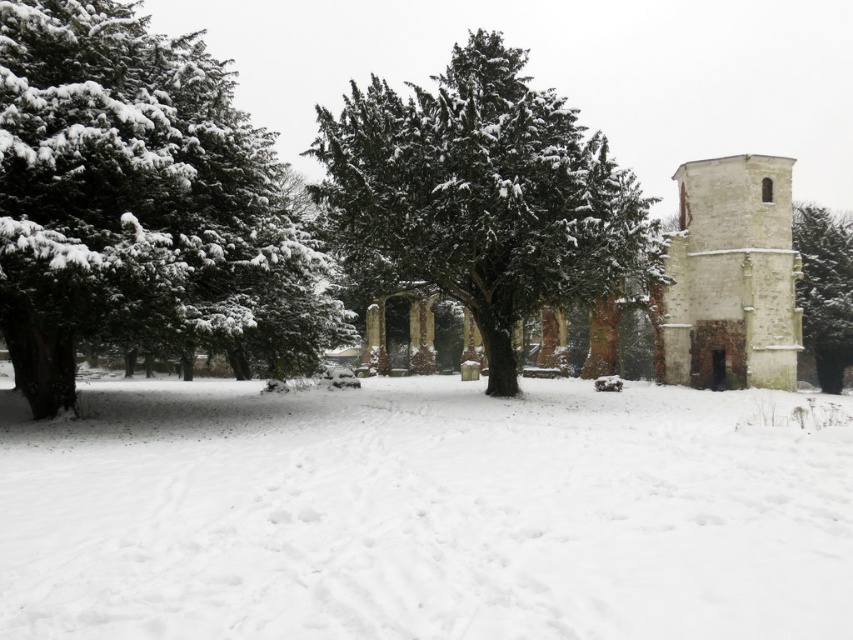
Question: Does green matte tree at left have a smaller size compared to snow-covered evergreen tree at center?

Choices:
 (A) yes
 (B) no

Answer: (A)

Question: Is snow-covered evergreen tree at center to the right of green textured stone column at right from the viewer's perspective?

Choices:
 (A) no
 (B) yes

Answer: (A)

Question: Estimate the real-world distances between objects in this image. Which object is farther from the green matte tree at left?

Choices:
 (A) snow-covered evergreen tree at center
 (B) green textured stone column at right
 (C) white stone tower at right
 (D) white fluffy snow at center

Answer: (B)

Question: Which point is closer to the camera taking this photo?

Choices:
 (A) (820, 289)
 (B) (438, 84)

Answer: (A)

Question: Can you confirm if green matte tree at left is wider than snow-covered evergreen tree at center?

Choices:
 (A) yes
 (B) no

Answer: (B)

Question: Which point appears closest to the camera in this image?

Choices:
 (A) (467, 154)
 (B) (824, 385)
 (C) (494, 484)
 (D) (45, 282)

Answer: (C)